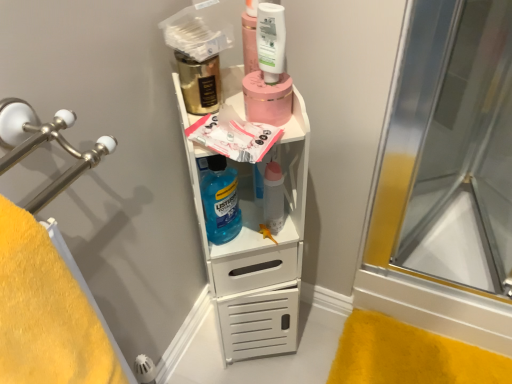
Question: Considering the positions of white glossy mouthwash at upper center, which is the first mouthwash in right-to-left order, and transparent glass shower door at right in the image, is white glossy mouthwash at upper center, which is the first mouthwash in right-to-left order, taller or shorter than transparent glass shower door at right?

Choices:
 (A) short
 (B) tall

Answer: (A)

Question: Looking at their shapes, would you say white glossy mouthwash at upper center, positioned as the 2th mouthwash in back-to-front order, is wider or thinner than transparent glass shower door at right?

Choices:
 (A) wide
 (B) thin

Answer: (B)

Question: Estimate the real-world distances between objects in this image. Which object is closer to the translucent plastic bottle at center?

Choices:
 (A) gold metallic mouthwash at upper center, acting as the first mouthwash starting from the back
 (B) yellow fluffy towel at left
 (C) blue translucent mouthwash at center
 (D) white glossy mouthwash at upper center, which ranks as the second mouthwash in left-to-right order
 (E) transparent glass shower door at right

Answer: (C)

Question: Estimate the real-world distances between objects in this image. Which object is closer to the transparent glass shower door at right?

Choices:
 (A) white glossy mouthwash at upper center, positioned as the 2th mouthwash in back-to-front order
 (B) white matte cabinet at center
 (C) translucent plastic bottle at center
 (D) pink matte jar at upper center
 (E) gold metallic mouthwash at upper center, which ranks as the first mouthwash in left-to-right order

Answer: (B)